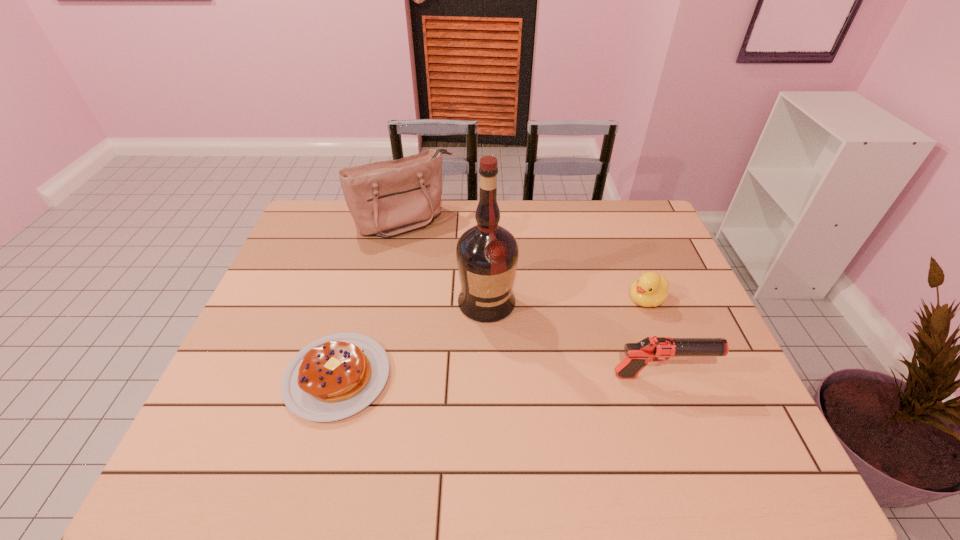
Image resolution: width=960 pixels, height=540 pixels. What are the coordinates of `vacant area at the far right corner of the desktop` in the screenshot? It's located at (646, 201).

You are a GUI agent. You are given a task and a screenshot of the screen. Output one action in this format:
    pyautogui.click(x=<x>, y=<y>)
    Task: Click on the free space between the fourth shortest object and the third tallest object
    The height and width of the screenshot is (540, 960).
    Given the screenshot: What is the action you would take?
    pyautogui.click(x=533, y=299)

Locate an element on the screen. blank region between the shortest object and the shoulder bag is located at coordinates (372, 299).

You are a GUI agent. You are given a task and a screenshot of the screen. Output one action in this format:
    pyautogui.click(x=<x>, y=<y>)
    Task: Click on the free space between the third tallest object and the liquor
    The width and height of the screenshot is (960, 540).
    Given the screenshot: What is the action you would take?
    pyautogui.click(x=574, y=339)

Locate an element on the screen. unoccupied position between the duckling and the shortest object is located at coordinates (492, 339).

This screenshot has height=540, width=960. Find the location of `free space between the liquor and the shortest object`. free space between the liquor and the shortest object is located at coordinates (412, 340).

The height and width of the screenshot is (540, 960). I want to click on empty space that is in between the gun and the tallest object, so click(x=574, y=339).

The height and width of the screenshot is (540, 960). What are the coordinates of `free space between the shoulder bag and the gun` in the screenshot? It's located at (533, 299).

You are a GUI agent. You are given a task and a screenshot of the screen. Output one action in this format:
    pyautogui.click(x=<x>, y=<y>)
    Task: Click on the unoccupied position between the duckling and the third object from right to left
    
    Given the screenshot: What is the action you would take?
    pyautogui.click(x=566, y=301)

Identify the location of free spot between the third shortest object and the farthest object. The height and width of the screenshot is (540, 960). (533, 299).